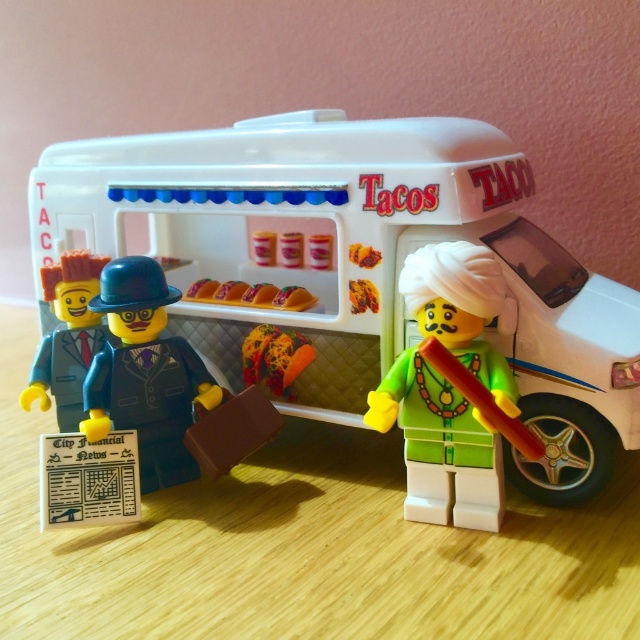
Question: Which point appears closest to the camera in this image?

Choices:
 (A) 273,387
 (B) 268,296
 (C) 116,298

Answer: (C)

Question: Which of the following is the closest to the observer?

Choices:
 (A) green matte turban at center
 (B) smooth plastic tacos at center
 (C) smooth plastic man at left

Answer: (A)

Question: Is green matte turban at center thinner than matte blue suit at center?

Choices:
 (A) yes
 (B) no

Answer: (B)

Question: Can you confirm if white plastic food truck at center is thinner than smooth plastic man at left?

Choices:
 (A) no
 (B) yes

Answer: (A)

Question: Which object is the closest to the smooth plastic man at left?

Choices:
 (A) matte blue suit at center
 (B) green matte turban at center
 (C) white plastic food truck at center
 (D) smooth plastic tacos at center

Answer: (A)

Question: Is green matte turban at center to the right of smooth plastic man at left from the viewer's perspective?

Choices:
 (A) no
 (B) yes

Answer: (B)